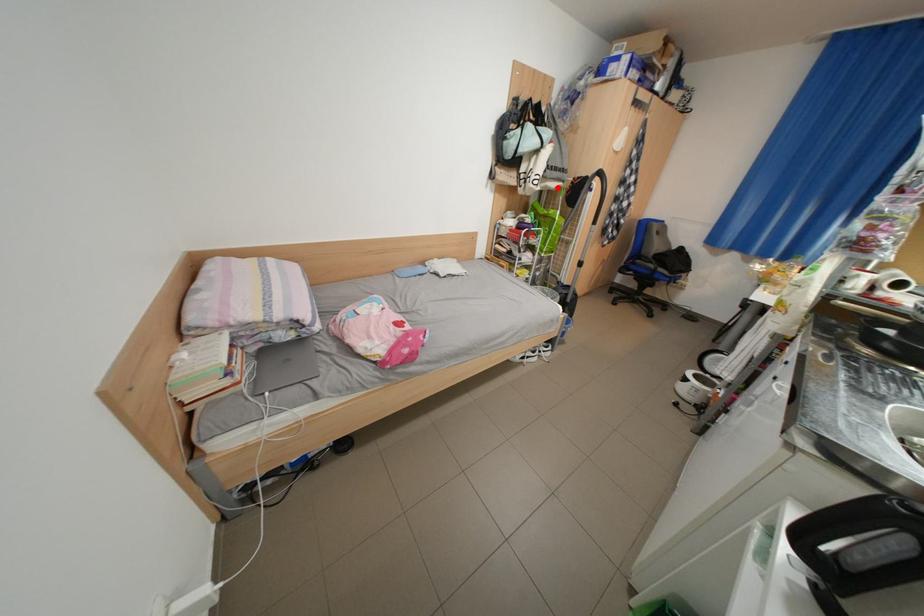
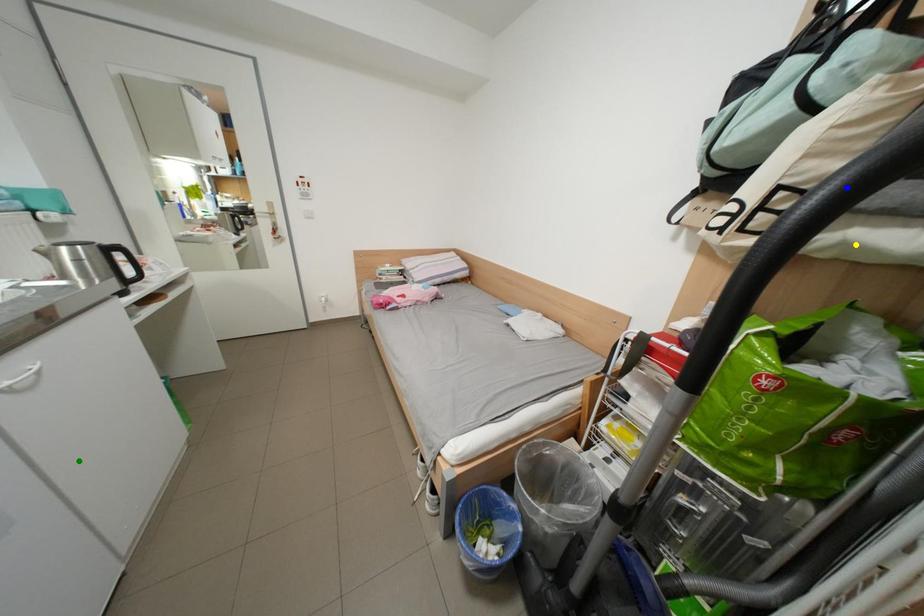
Question: I am providing you with two images of the same scene from different viewpoints. A red point is marked on the first image. You are given multiple points on the second image. In image 2, which mark is for the same physical point as the one in image 1?

Choices:
 (A) green point
 (B) blue point
 (C) yellow point

Answer: (C)